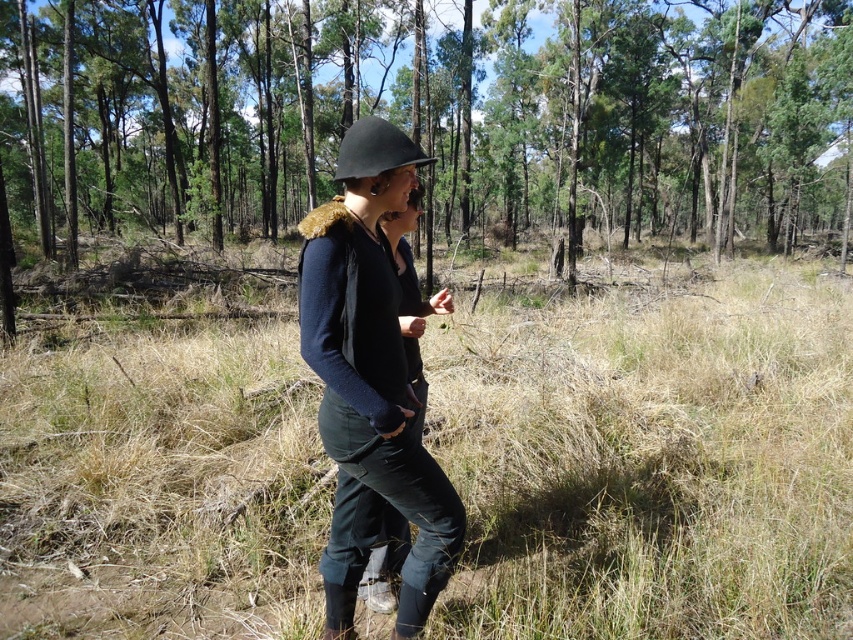
Who is lower down, green grass at center or black matte helmet at center?

black matte helmet at center

Which is more to the left, green grass at center or black matte helmet at center?

From the viewer's perspective, black matte helmet at center appears more on the left side.

Between point (260, 76) and point (358, 129), which one is positioned in front?

Point (358, 129) is more forward.

The width and height of the screenshot is (853, 640). What are the coordinates of `green grass at center` in the screenshot? It's located at (431, 122).

Does green grass at center have a lesser height compared to matte black helmet at center?

No, green grass at center is not shorter than matte black helmet at center.

Does green grass at center appear under matte black helmet at center?

Incorrect, green grass at center is not positioned below matte black helmet at center.

Where is `green grass at center`? The image size is (853, 640). green grass at center is located at coordinates (431, 122).

Who is positioned more to the right, dry grass at center or matte black helmet at center?

dry grass at center

Is dry grass at center to the right of matte black helmet at center from the viewer's perspective?

Indeed, dry grass at center is positioned on the right side of matte black helmet at center.

Identify the location of dry grass at center. This screenshot has width=853, height=640. (651, 458).